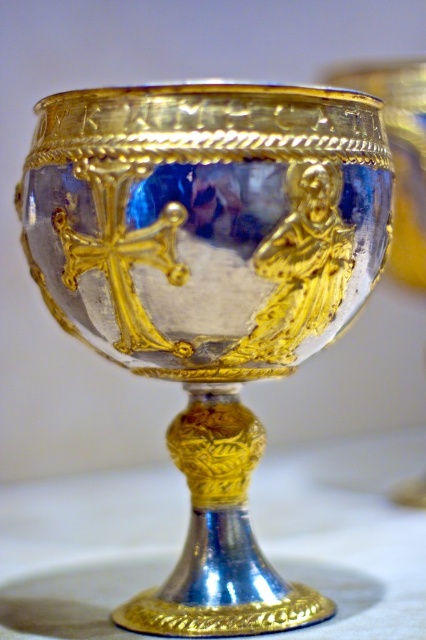
Is white fabric at center taller than gold/glass goblet at center?

No, white fabric at center is not taller than gold/glass goblet at center.

Consider the image. Which is below, white fabric at center or gold/glass goblet at center?

white fabric at center

Is point (359, 449) less distant than point (400, 173)?

No, (359, 449) is further to viewer.

You are a GUI agent. You are given a task and a screenshot of the screen. Output one action in this format:
    pyautogui.click(x=<x>, y=<y>)
    Task: Click on the white fabric at center
    Image resolution: width=426 pixels, height=640 pixels.
    Given the screenshot: What is the action you would take?
    pyautogui.click(x=347, y=532)